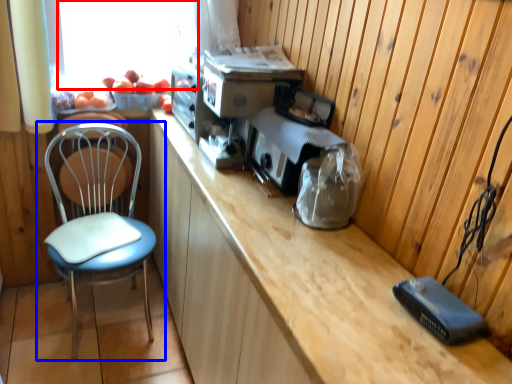
Question: Among these objects, which one is nearest to the camera, window screen (highlighted by a red box) or chair (highlighted by a blue box)?

Choices:
 (A) window screen
 (B) chair

Answer: (B)